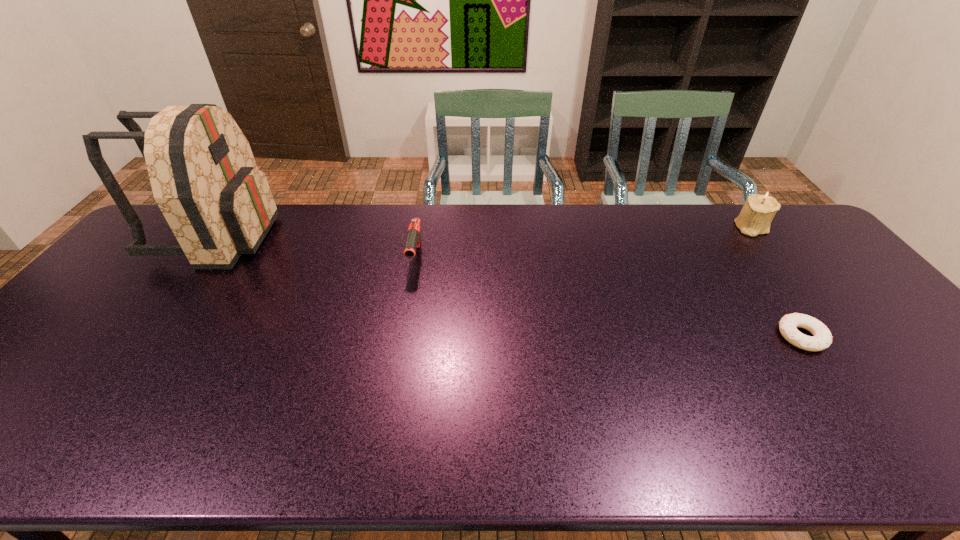
What are the coordinates of `free space located on the left of the nearest object` in the screenshot? It's located at (716, 336).

You are a GUI agent. You are given a task and a screenshot of the screen. Output one action in this format:
    pyautogui.click(x=<x>, y=<y>)
    Task: Click on the backpack at the far edge
    This screenshot has height=540, width=960.
    Given the screenshot: What is the action you would take?
    pyautogui.click(x=204, y=178)

Where is `candle_holder that is at the far edge`? The width and height of the screenshot is (960, 540). candle_holder that is at the far edge is located at coordinates (755, 218).

The height and width of the screenshot is (540, 960). I want to click on gun located at the far edge, so click(413, 241).

Locate an element on the screen. object situated at the left edge is located at coordinates (204, 178).

Find the location of `object located at the right edge`. object located at the right edge is located at coordinates (755, 218).

Where is `object at the far left corner`? This screenshot has height=540, width=960. object at the far left corner is located at coordinates (204, 178).

Find the location of a particular element. object that is at the far right corner is located at coordinates (755, 218).

At what (x,y) coordinates should I click in order to perform the action: click on free space at the far edge of the desktop. Please return your answer as a coordinate pair (x, y). Looking at the image, I should click on (613, 232).

Identify the location of free region at the near edge. (126, 440).